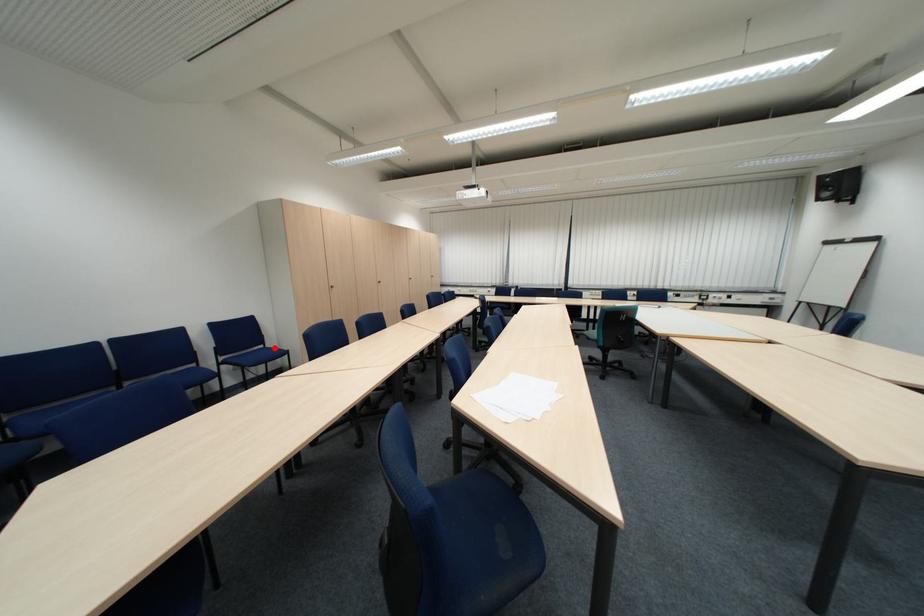
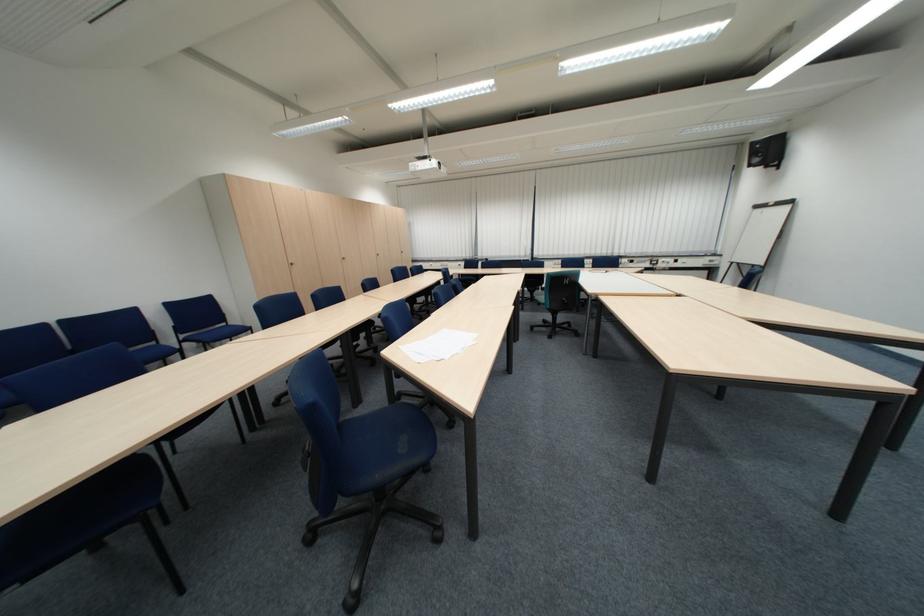
Question: I am providing you with two images of the same scene from different viewpoints. In image1, a red point is highlighted. Considering the same 3D point in image2, which of the following is correct?

Choices:
 (A) It is closer
 (B) It is farther

Answer: (A)